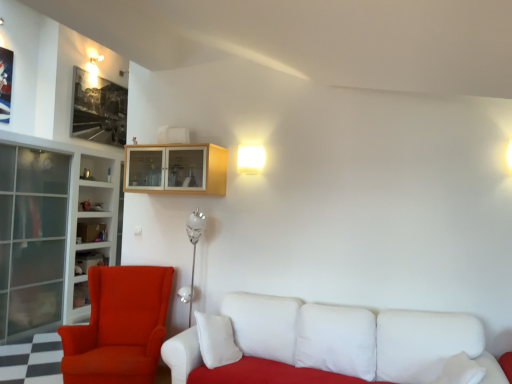
Question: Is white fabric couch at lower right placed right next to black matte picture frame at upper left?

Choices:
 (A) yes
 (B) no

Answer: (B)

Question: Is white fabric couch at lower right oriented towards black matte picture frame at upper left?

Choices:
 (A) yes
 (B) no

Answer: (B)

Question: From the image's perspective, is white fabric couch at lower right beneath black matte picture frame at upper left?

Choices:
 (A) yes
 (B) no

Answer: (A)

Question: Can you confirm if white fabric couch at lower right is shorter than black matte picture frame at upper left?

Choices:
 (A) no
 (B) yes

Answer: (B)

Question: Considering the relative positions of white fabric couch at lower right and black matte picture frame at upper left in the image provided, is white fabric couch at lower right to the left of black matte picture frame at upper left from the viewer's perspective?

Choices:
 (A) yes
 (B) no

Answer: (B)

Question: Is black matte picture frame at upper left inside white fabric couch at lower right?

Choices:
 (A) no
 (B) yes

Answer: (A)

Question: From a real-world perspective, is white fabric couch at lower right positioned over white glass bookshelf at left based on gravity?

Choices:
 (A) yes
 (B) no

Answer: (B)

Question: Can you confirm if white fabric couch at lower right is wider than white glass bookshelf at left?

Choices:
 (A) no
 (B) yes

Answer: (B)

Question: Does white fabric couch at lower right have a larger size compared to white glass bookshelf at left?

Choices:
 (A) yes
 (B) no

Answer: (A)

Question: Can you confirm if white fabric couch at lower right is positioned to the left of white glass bookshelf at left?

Choices:
 (A) yes
 (B) no

Answer: (B)

Question: Can you confirm if white fabric couch at lower right is shorter than white glass bookshelf at left?

Choices:
 (A) yes
 (B) no

Answer: (A)

Question: From the image's perspective, does white fabric couch at lower right appear higher than white glass bookshelf at left?

Choices:
 (A) no
 (B) yes

Answer: (A)

Question: Considering the relative positions of black matte picture frame at upper left and matte glass shelf at left in the image provided, is black matte picture frame at upper left to the right of matte glass shelf at left from the viewer's perspective?

Choices:
 (A) yes
 (B) no

Answer: (B)